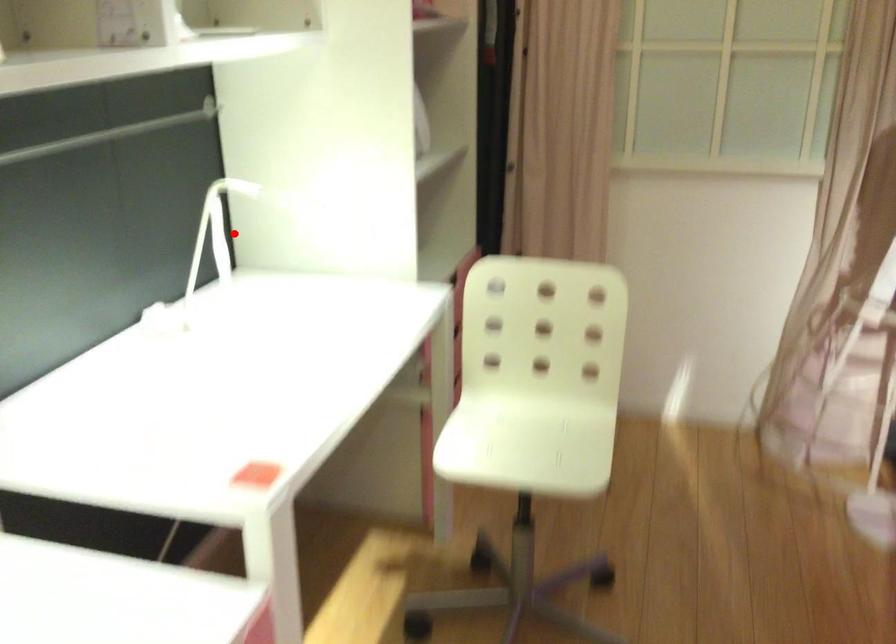
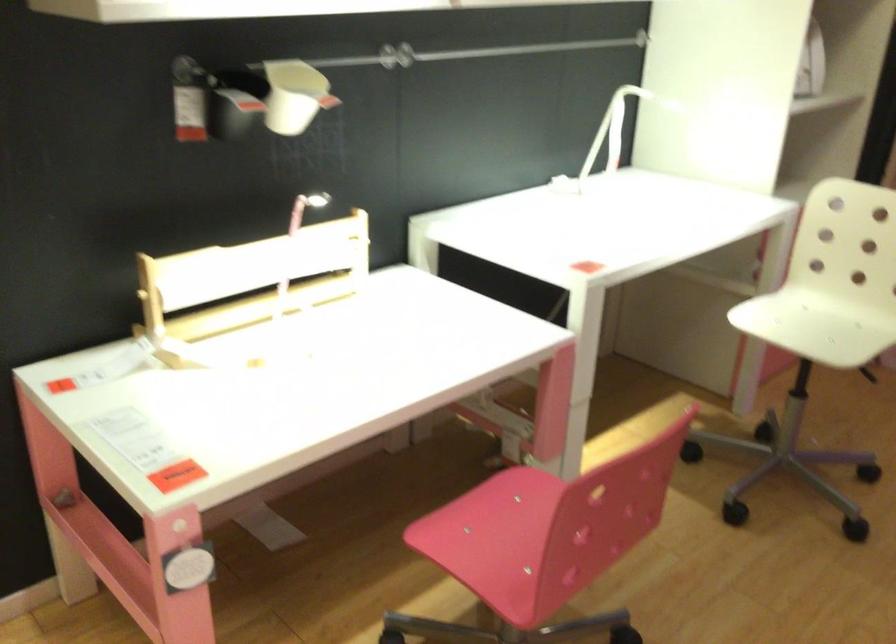
Where in the second image is the point corresponding to the highlighted location from the first image?

(618, 126)